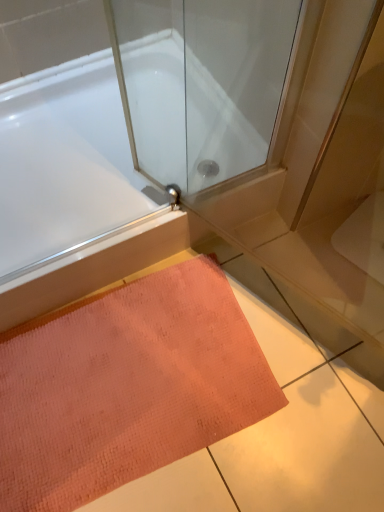
Locate an element on the screen. The image size is (384, 512). orange textured mat at lower center is located at coordinates (126, 387).

The image size is (384, 512). What do you see at coordinates (126, 387) in the screenshot?
I see `orange textured mat at lower center` at bounding box center [126, 387].

This screenshot has width=384, height=512. Describe the element at coordinates (70, 190) in the screenshot. I see `white glossy bathtub at upper left` at that location.

At what (x,y) coordinates should I click in order to perform the action: click on white glossy bathtub at upper left. Please return your answer as a coordinate pair (x, y). This screenshot has height=512, width=384. Looking at the image, I should click on (70, 190).

Identify the location of orange textured mat at lower center. The width and height of the screenshot is (384, 512). (126, 387).

Which object is positioned more to the left, orange textured mat at lower center or white glossy bathtub at upper left?

Positioned to the left is white glossy bathtub at upper left.

Which object is more forward, orange textured mat at lower center or white glossy bathtub at upper left?

Result: orange textured mat at lower center is closer to the camera.

Is point (164, 406) positioned before point (31, 296)?

Yes, it is.

From the image's perspective, is orange textured mat at lower center on white glossy bathtub at upper left?

Actually, orange textured mat at lower center appears below white glossy bathtub at upper left in the image.

From a real-world perspective, between orange textured mat at lower center and white glossy bathtub at upper left, who is vertically lower?

orange textured mat at lower center is physically lower.

Considering the sizes of objects orange textured mat at lower center and white glossy bathtub at upper left in the image provided, who is thinner, orange textured mat at lower center or white glossy bathtub at upper left?

orange textured mat at lower center.

From their relative heights in the image, would you say orange textured mat at lower center is taller or shorter than white glossy bathtub at upper left?

Considering their sizes, orange textured mat at lower center has less height than white glossy bathtub at upper left.

Considering the sizes of orange textured mat at lower center and white glossy bathtub at upper left in the image, is orange textured mat at lower center bigger or smaller than white glossy bathtub at upper left?

orange textured mat at lower center is smaller than white glossy bathtub at upper left.

Looking at this image, can we say orange textured mat at lower center lies outside white glossy bathtub at upper left?

Absolutely, orange textured mat at lower center is external to white glossy bathtub at upper left.

Is orange textured mat at lower center beside white glossy bathtub at upper left?

No, orange textured mat at lower center is not in contact with white glossy bathtub at upper left.

Is orange textured mat at lower center oriented towards white glossy bathtub at upper left?

No, orange textured mat at lower center is not facing towards white glossy bathtub at upper left.

Can you tell me how much orange textured mat at lower center and white glossy bathtub at upper left differ in facing direction?

1.24 degrees.

At what (x,y) coordinates should I click in order to perform the action: click on bathtub behind the orange textured mat at lower center. Please return your answer as a coordinate pair (x, y). This screenshot has width=384, height=512. Looking at the image, I should click on (70, 190).

Considering the relative positions of white glossy bathtub at upper left and orange textured mat at lower center in the image provided, is white glossy bathtub at upper left to the left of orange textured mat at lower center from the viewer's perspective?

Indeed, white glossy bathtub at upper left is positioned on the left side of orange textured mat at lower center.

Which object is more forward, white glossy bathtub at upper left or orange textured mat at lower center?

orange textured mat at lower center.

Is point (66, 163) farther from camera compared to point (144, 377)?

Yes, point (66, 163) is farther from viewer.

From the image's perspective, would you say white glossy bathtub at upper left is shown under orange textured mat at lower center?

Incorrect, from the image's perspective, white glossy bathtub at upper left is higher than orange textured mat at lower center.

From a real-world perspective, between white glossy bathtub at upper left and orange textured mat at lower center, who is vertically lower?

From a 3D spatial view, orange textured mat at lower center is below.

In terms of width, does white glossy bathtub at upper left look wider or thinner when compared to orange textured mat at lower center?

Considering their sizes, white glossy bathtub at upper left looks broader than orange textured mat at lower center.

Considering the relative sizes of white glossy bathtub at upper left and orange textured mat at lower center in the image provided, is white glossy bathtub at upper left shorter than orange textured mat at lower center?

Incorrect, the height of white glossy bathtub at upper left does not fall short of that of orange textured mat at lower center.

Between white glossy bathtub at upper left and orange textured mat at lower center, which one has larger size?

With larger size is white glossy bathtub at upper left.

From the picture: Is white glossy bathtub at upper left not inside orange textured mat at lower center?

Yes, white glossy bathtub at upper left is outside of orange textured mat at lower center.

Is white glossy bathtub at upper left positioned far away from orange textured mat at lower center?

Actually, white glossy bathtub at upper left and orange textured mat at lower center are a little close together.

Is white glossy bathtub at upper left turned away from orange textured mat at lower center?

No, orange textured mat at lower center is not at the back of white glossy bathtub at upper left.

How many degrees apart are the facing directions of white glossy bathtub at upper left and orange textured mat at lower center?

The angular difference between white glossy bathtub at upper left and orange textured mat at lower center is 1.24 degrees.

Identify the location of bathtub on the left of orange textured mat at lower center. (70, 190).

You are a GUI agent. You are given a task and a screenshot of the screen. Output one action in this format:
    pyautogui.click(x=<x>, y=<y>)
    Task: Click on the doormat below the white glossy bathtub at upper left (from the image's perspective)
    
    Given the screenshot: What is the action you would take?
    pyautogui.click(x=126, y=387)

Image resolution: width=384 pixels, height=512 pixels. Find the location of `bathtub lying above the orange textured mat at lower center (from the image's perspective)`. bathtub lying above the orange textured mat at lower center (from the image's perspective) is located at coordinates (x=70, y=190).